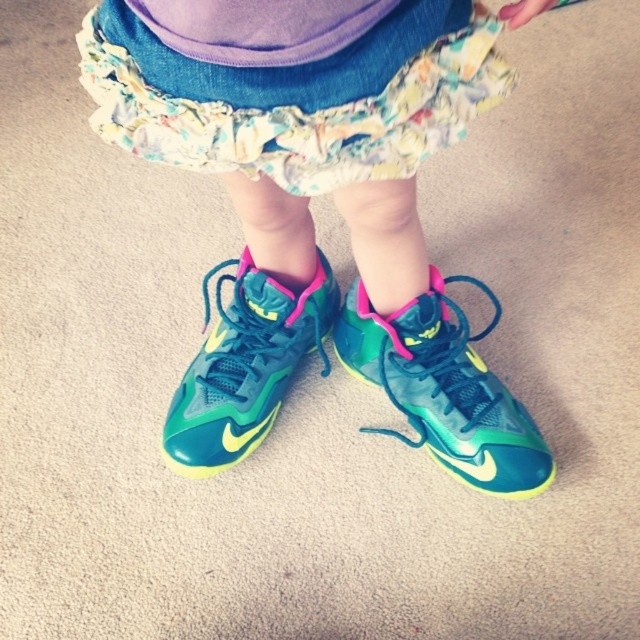
Question: Can you confirm if shiny teal sneakers at center is thinner than floral cotton dress at center?

Choices:
 (A) no
 (B) yes

Answer: (A)

Question: Which object appears closest to the camera in this image?

Choices:
 (A) shiny teal sneakers at center
 (B) glossy synthetic shoe at center
 (C) neon green mesh shoe at center
 (D) floral cotton dress at center

Answer: (A)

Question: Which object is closer to the camera taking this photo?

Choices:
 (A) shiny teal sneakers at center
 (B) neon green mesh shoe at center

Answer: (A)

Question: Does shiny teal sneakers at center appear on the right side of floral cotton dress at center?

Choices:
 (A) yes
 (B) no

Answer: (A)

Question: Estimate the real-world distances between objects in this image. Which object is farther from the shiny teal sneakers at center?

Choices:
 (A) glossy synthetic shoe at center
 (B) floral cotton dress at center

Answer: (B)

Question: Does floral cotton dress at center come behind neon green mesh shoe at center?

Choices:
 (A) no
 (B) yes

Answer: (A)